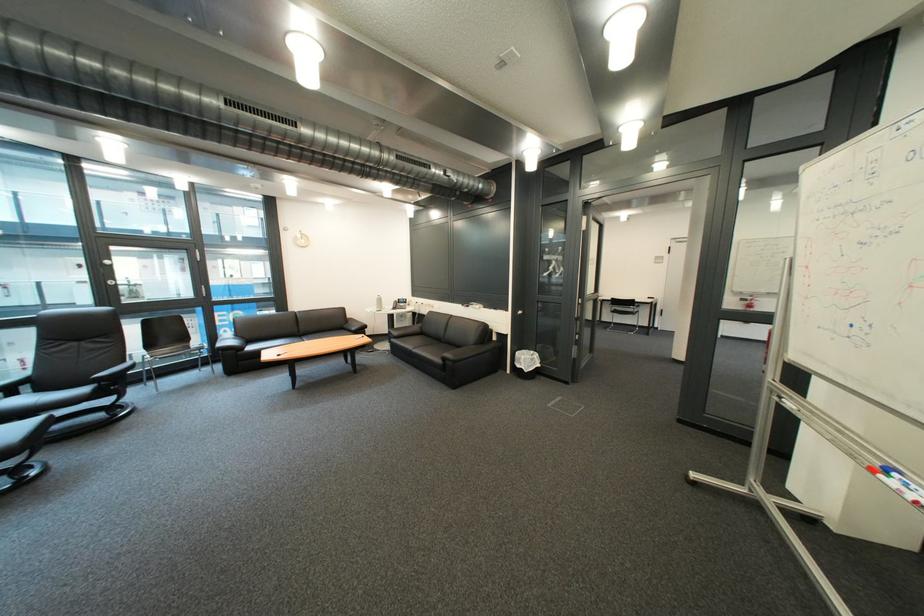
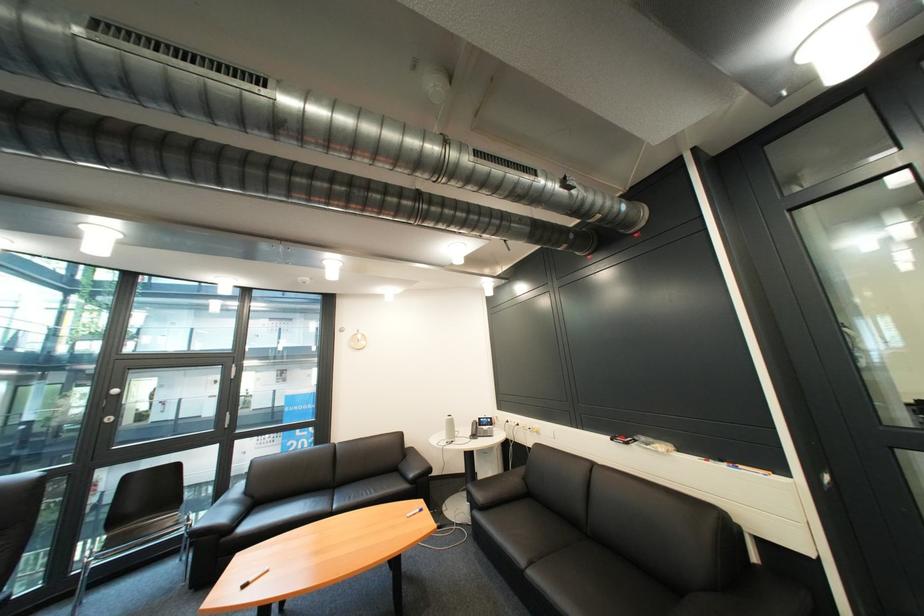
Where in the second image is the point corresponding to (x=506, y=312) from the first image?

(736, 468)